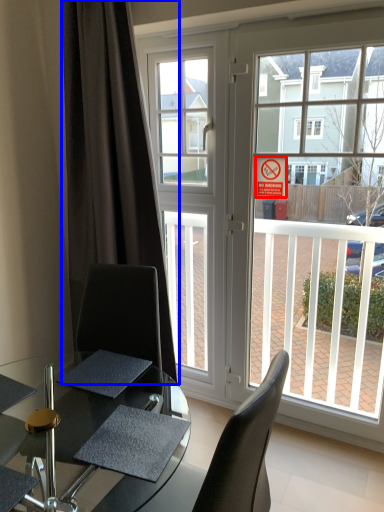
Question: Among these objects, which one is nearest to the camera, parking sign (highlighted by a red box) or curtain (highlighted by a blue box)?

Choices:
 (A) parking sign
 (B) curtain

Answer: (B)